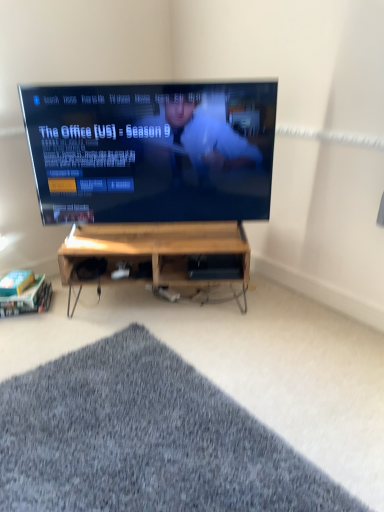
Question: From the image's perspective, is woodenmaterial/texturedesk at center located beneath wooden at center, positioned as the 1th shelf in right-to-left order?

Choices:
 (A) yes
 (B) no

Answer: (A)

Question: Are woodenmaterial/texturedesk at center and wooden at center, acting as the second shelf starting from the bottom, beside each other?

Choices:
 (A) yes
 (B) no

Answer: (B)

Question: Does woodenmaterial/texturedesk at center have a lesser height compared to wooden at center, positioned as the 1th shelf in right-to-left order?

Choices:
 (A) yes
 (B) no

Answer: (B)

Question: Does woodenmaterial/texturedesk at center lie behind wooden at center, which is the 2th shelf in left-to-right order?

Choices:
 (A) yes
 (B) no

Answer: (B)

Question: Can you confirm if woodenmaterial/texturedesk at center is positioned to the left of wooden at center, which is the 2th shelf in left-to-right order?

Choices:
 (A) no
 (B) yes

Answer: (B)

Question: From the image's perspective, relative to black glossy tv at center, is woodenmaterial/texturedesk at center above or below?

Choices:
 (A) above
 (B) below

Answer: (B)

Question: In terms of width, does woodenmaterial/texturedesk at center look wider or thinner when compared to black glossy tv at center?

Choices:
 (A) wide
 (B) thin

Answer: (A)

Question: In terms of size, does woodenmaterial/texturedesk at center appear bigger or smaller than black glossy tv at center?

Choices:
 (A) big
 (B) small

Answer: (B)

Question: Considering the positions of point (61, 283) and point (173, 153), is point (61, 283) closer or farther from the camera than point (173, 153)?

Choices:
 (A) closer
 (B) farther

Answer: (B)

Question: From a real-world perspective, relative to wooden at center, which is the 2th shelf in left-to-right order, is black glossy tv at center vertically above or below?

Choices:
 (A) above
 (B) below

Answer: (A)

Question: Relative to wooden at center, which is the 2th shelf in left-to-right order, is black glossy tv at center in front or behind?

Choices:
 (A) front
 (B) behind

Answer: (A)

Question: Is point (162, 221) positioned closer to the camera than point (187, 266)?

Choices:
 (A) farther
 (B) closer

Answer: (B)

Question: Is black glossy tv at center spatially inside wooden at center, acting as the second shelf starting from the bottom, or outside of it?

Choices:
 (A) inside
 (B) outside

Answer: (B)

Question: Relative to woodenmaterial/textureshelf at lower left, which is the first shelf from bottom to top, is black glossy tv at center in front or behind?

Choices:
 (A) front
 (B) behind

Answer: (A)

Question: From their relative heights in the image, would you say black glossy tv at center is taller or shorter than woodenmaterial/textureshelf at lower left, which appears as the 1th shelf when viewed from the left?

Choices:
 (A) short
 (B) tall

Answer: (B)